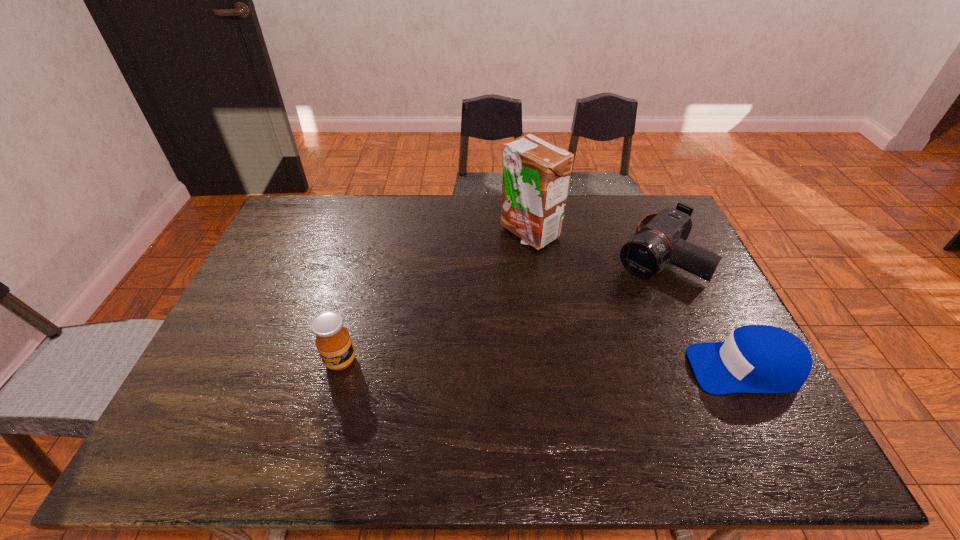
Locate an element on the screen. camcorder at the right edge is located at coordinates (659, 236).

At what (x,y) coordinates should I click in order to perform the action: click on object located in the far right corner section of the desktop. Please return your answer as a coordinate pair (x, y). Looking at the image, I should click on (659, 236).

Where is `object located at the near right corner`? object located at the near right corner is located at coordinates (755, 358).

The height and width of the screenshot is (540, 960). I want to click on free space at the far edge of the desktop, so click(590, 211).

Where is `vacant space at the near edge of the desktop`? The width and height of the screenshot is (960, 540). vacant space at the near edge of the desktop is located at coordinates (260, 394).

This screenshot has height=540, width=960. In the image, there is a desktop. What are the coordinates of `vacant space at the left edge` in the screenshot? It's located at (307, 264).

Identify the location of vacant point at the right edge. The image size is (960, 540). (666, 272).

Identify the location of unoccupied area between the second object from left to right and the camcorder. (591, 244).

This screenshot has width=960, height=540. I want to click on free space that is in between the leftmost object and the camcorder, so click(497, 308).

Identify the location of vacant space in between the tallest object and the camcorder. The height and width of the screenshot is (540, 960). (591, 244).